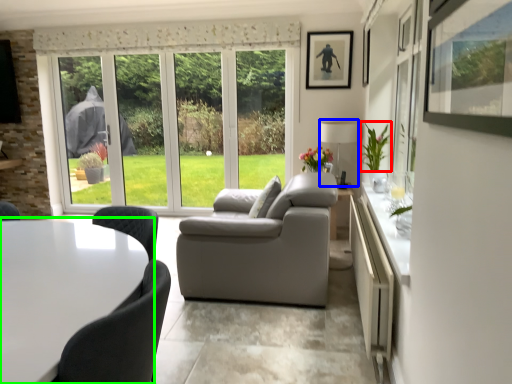
Question: Which object is the farthest from plant (highlighted by a red box)? Choose among these: lamp (highlighted by a blue box) or table (highlighted by a green box).

Choices:
 (A) lamp
 (B) table

Answer: (B)